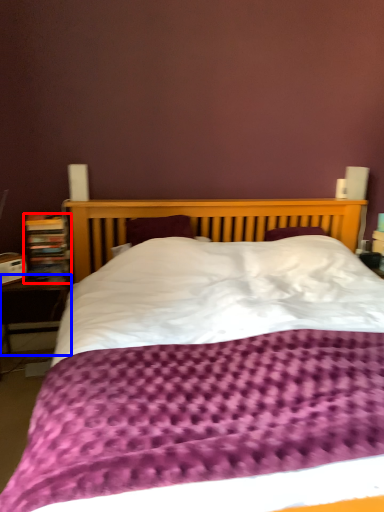
Question: Which object appears farthest to the camera in this image, bookcase (highlighted by a red box) or table (highlighted by a blue box)?

Choices:
 (A) bookcase
 (B) table

Answer: (A)